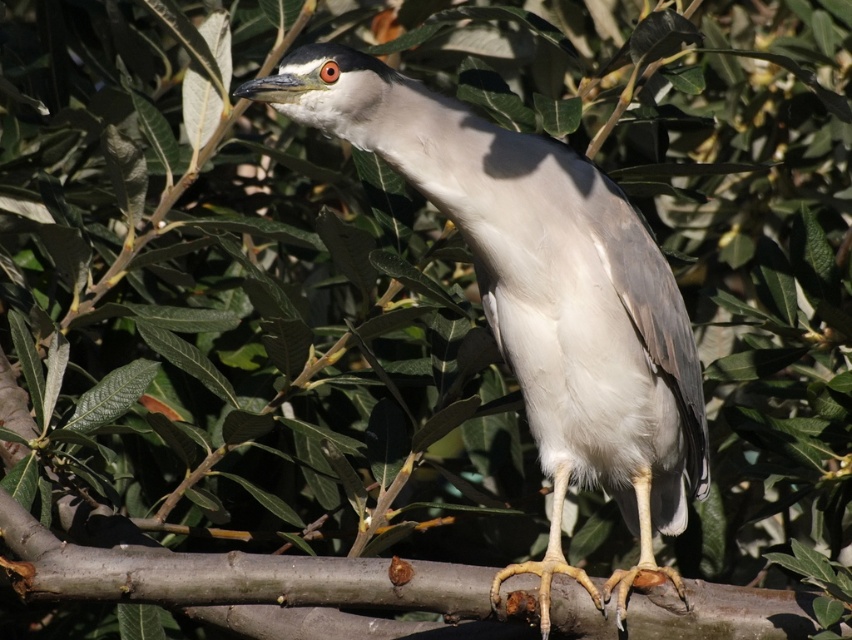
Is white matte bird at center taller than brown rough tree branch at center?

Correct, white matte bird at center is much taller as brown rough tree branch at center.

Is point (597, 387) farther from viewer compared to point (364, 579)?

Yes, point (597, 387) is farther from viewer.

Locate an element on the screen. This screenshot has width=852, height=640. white matte bird at center is located at coordinates [540, 294].